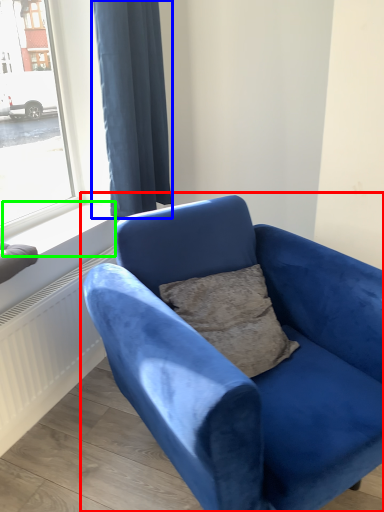
Question: Which object is the farthest from studio couch (highlighted by a red box)? Choose among these: curtain (highlighted by a blue box) or window sill (highlighted by a green box).

Choices:
 (A) curtain
 (B) window sill

Answer: (A)